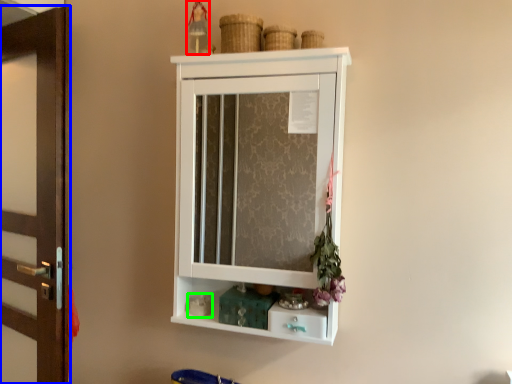
Question: Based on their relative distances, which object is farther from toy (highlighted by a red box)? Choose from door (highlighted by a blue box) and toy (highlighted by a green box).

Choices:
 (A) door
 (B) toy

Answer: (B)